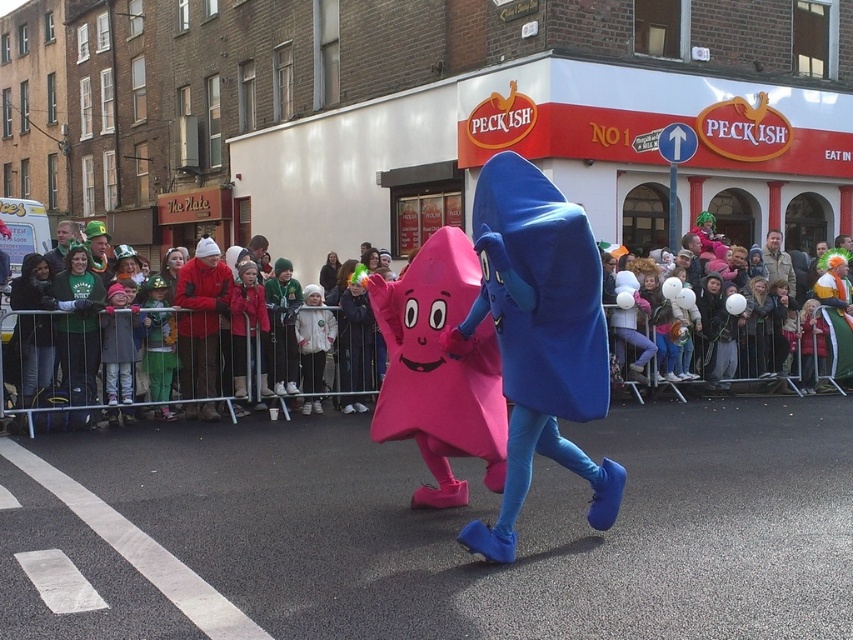
Is blue fabric costume at center thinner than matte pink star at center?

Correct, blue fabric costume at center's width is less than matte pink star at center's.

Does point (590, 273) come in front of point (480, 336)?

Yes, point (590, 273) is closer to viewer.

Is point (482, 276) closer to viewer compared to point (144, 301)?

Yes, it is in front of point (144, 301).

The image size is (853, 640). I want to click on blue fabric costume at center, so click(538, 337).

Is point (550, 260) farther from viewer compared to point (224, 394)?

That is False.

Is blue fabric costume at center positioned in front of matte pink costume at center?

Yes.

Which is behind, point (505, 160) or point (32, 356)?

Positioned behind is point (32, 356).

Where is `blue fabric costume at center`? Image resolution: width=853 pixels, height=640 pixels. blue fabric costume at center is located at coordinates (538, 337).

Is matte pink costume at center to the right of white fluffy balloons at center from the viewer's perspective?

No, matte pink costume at center is not to the right of white fluffy balloons at center.

Who is taller, matte pink costume at center or white fluffy balloons at center?

white fluffy balloons at center

The height and width of the screenshot is (640, 853). What do you see at coordinates (140, 333) in the screenshot?
I see `matte pink costume at center` at bounding box center [140, 333].

This screenshot has width=853, height=640. I want to click on matte pink costume at center, so click(140, 333).